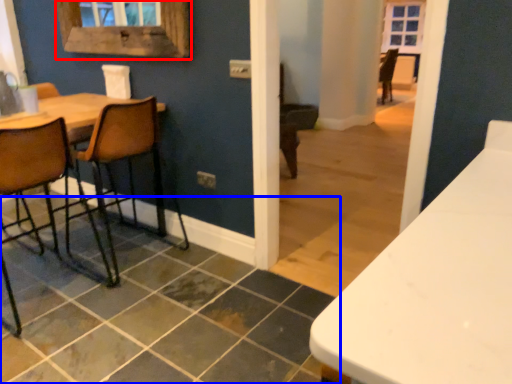
Question: Which of the following is the closest to the observer, window frame (highlighted by a red box) or tile (highlighted by a blue box)?

Choices:
 (A) window frame
 (B) tile

Answer: (B)